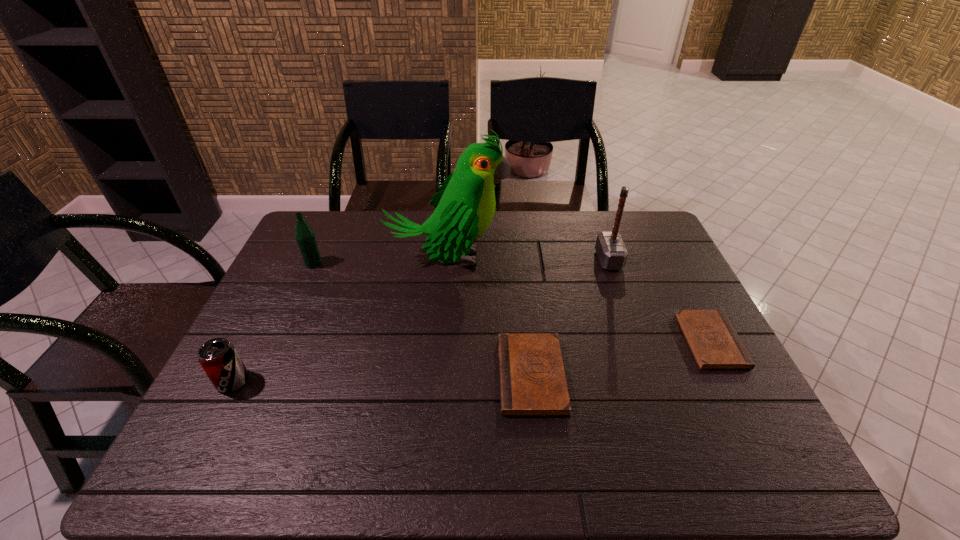
Identify the location of the leftmost object. (218, 357).

This screenshot has height=540, width=960. I want to click on vacant region located 0.150m on the spine side of the taller diary, so click(x=438, y=375).

Where is `vacant area situated 0.130m on the spine side of the taller diary`? vacant area situated 0.130m on the spine side of the taller diary is located at coordinates (446, 375).

Locate an element on the screen. free space located 0.340m on the spine side of the taller diary is located at coordinates (360, 375).

Locate an element on the screen. The image size is (960, 540). blank space located on the striking surface of the fifth object from left to right is located at coordinates (519, 260).

I want to click on blank space located 0.380m on the striking surface of the fifth object from left to right, so click(x=479, y=260).

At what (x,y) coordinates should I click in order to perform the action: click on free location located 0.200m on the striking surface of the fifth object from left to right. Please return your answer as a coordinate pair (x, y). This screenshot has width=960, height=540. Looking at the image, I should click on (535, 260).

The image size is (960, 540). I want to click on free point located on the beak of the parakeet, so click(610, 259).

Image resolution: width=960 pixels, height=540 pixels. I want to click on vacant space positioned 0.140m on the back of the bottle, so click(327, 233).

Locate an element on the screen. This screenshot has height=540, width=960. vacant space positioned on the back of the fourth tallest object is located at coordinates (285, 278).